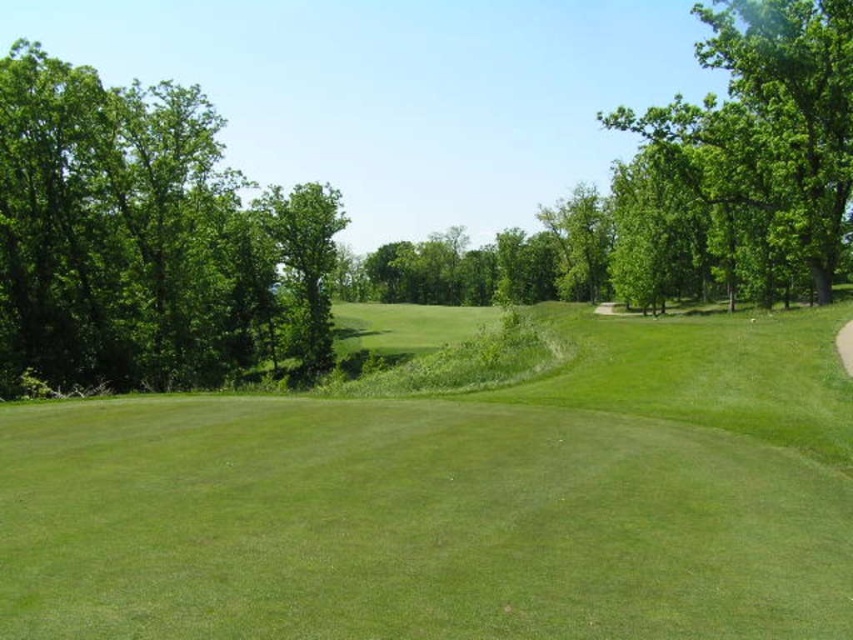
Does green leafy tree at left have a lesser height compared to green leafy tree at center?

Yes.

Measure the distance between green leafy tree at left and camera.

30.27 meters

Is point (270, 243) positioned behind point (341, 208)?

That is False.

Where is `green leafy tree at left`? The width and height of the screenshot is (853, 640). green leafy tree at left is located at coordinates (148, 241).

Consider the image. Which is above, green grassy field at center or green leafy tree at left?

green leafy tree at left

Does point (96, 584) come farther from viewer compared to point (16, 157)?

No, (96, 584) is in front of (16, 157).

Does point (722, 372) come closer to viewer compared to point (102, 179)?

Yes, point (722, 372) is closer to viewer.

Locate an element on the screen. The width and height of the screenshot is (853, 640). green grassy field at center is located at coordinates (456, 500).

Which of these two, green grassy field at center or green leafy tree at center, stands taller?

green leafy tree at center is taller.

In the scene shown: Does green grassy field at center appear on the right side of green leafy tree at center?

Yes, green grassy field at center is to the right of green leafy tree at center.

The width and height of the screenshot is (853, 640). In order to click on green grassy field at center in this screenshot , I will do `click(456, 500)`.